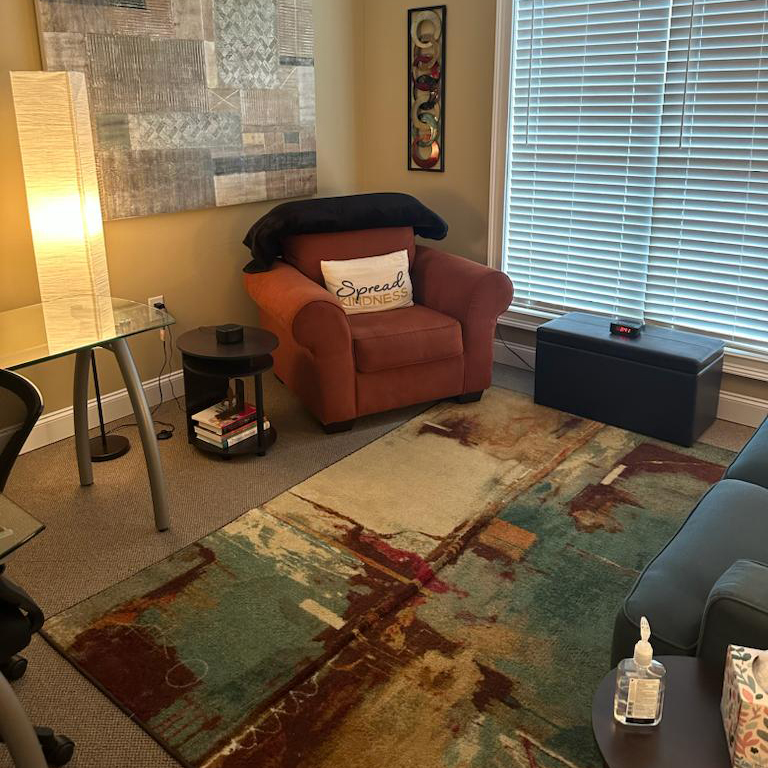
Identify the location of rust colored chair. point(428,362).